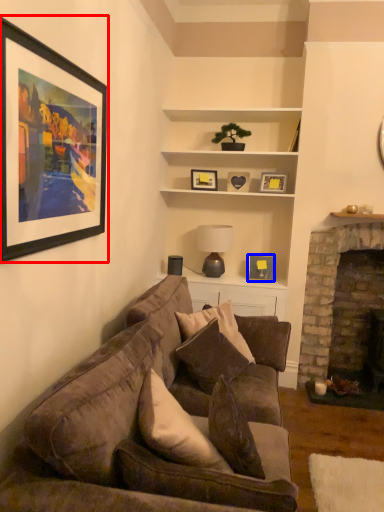
Question: Which object is closer to the camera taking this photo, picture frame (highlighted by a red box) or picture frame (highlighted by a blue box)?

Choices:
 (A) picture frame
 (B) picture frame

Answer: (A)